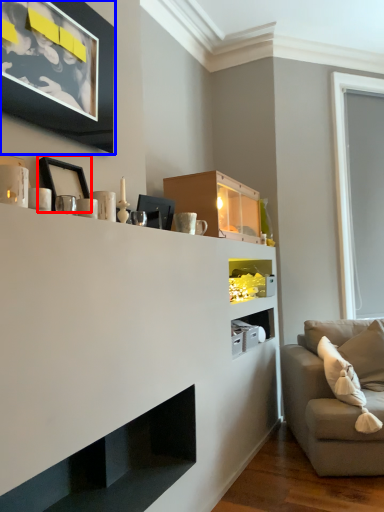
Question: Among these objects, which one is farthest to the camera, picture frame (highlighted by a red box) or picture frame (highlighted by a blue box)?

Choices:
 (A) picture frame
 (B) picture frame

Answer: (A)